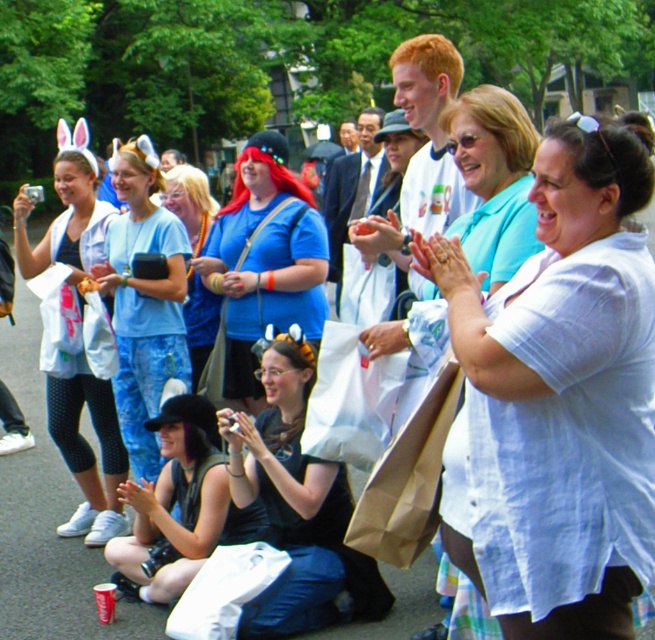
Question: Which object is the closest to the light blue denim jeans at center?

Choices:
 (A) blue fabric shirt at center
 (B) matte white jacket at center

Answer: (A)

Question: Among these points, which one is nearest to the camera?

Choices:
 (A) (572, 412)
 (B) (122, 198)

Answer: (A)

Question: Can you confirm if light blue denim jeans at center is smaller than blue fabric shirt at center?

Choices:
 (A) no
 (B) yes

Answer: (A)

Question: In this image, where is blue matte shirt at center located relative to blue fabric shirt at center?

Choices:
 (A) above
 (B) below

Answer: (B)

Question: Which object appears closest to the camera in this image?

Choices:
 (A) matte white jacket at center
 (B) blue fabric shirt at center
 (C) white cotton shirt at center

Answer: (C)

Question: Does light blue denim jeans at center have a larger size compared to matte white jacket at center?

Choices:
 (A) yes
 (B) no

Answer: (A)